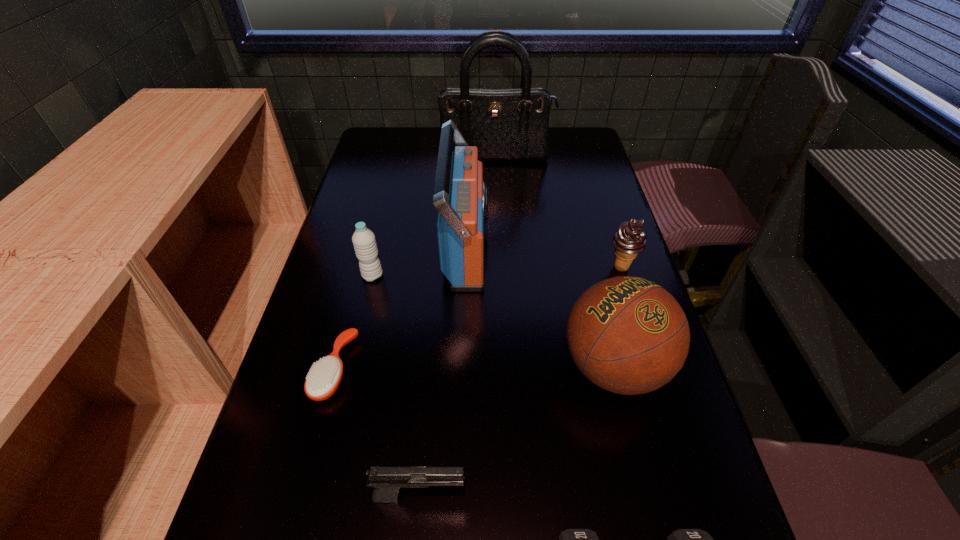
Where is `free space between the icecream and the radio receiver`? Image resolution: width=960 pixels, height=540 pixels. free space between the icecream and the radio receiver is located at coordinates (543, 258).

At what (x,y) coordinates should I click in order to perform the action: click on empty location between the icecream and the tallest object. Please return your answer as a coordinate pair (x, y). The height and width of the screenshot is (540, 960). Looking at the image, I should click on (559, 213).

At what (x,y) coordinates should I click in order to perform the action: click on empty space that is in between the water bottle and the tallest object. Please return your answer as a coordinate pair (x, y). Looking at the image, I should click on (434, 217).

In order to click on unoccupied area between the handbag and the water bottle in this screenshot , I will do `click(434, 217)`.

Identify the location of vacant space that is in between the water bottle and the tallest object. (434, 217).

Choose which object is the second nearest neighbor to the radio receiver. Please provide its 2D coordinates. Your answer should be formatted as a tuple, i.e. [(x, y)], where the tuple contains the x and y coordinates of a point satisfying the conditions above.

[(627, 335)]

Identify which object is the third closest to the water bottle. Please provide its 2D coordinates. Your answer should be formatted as a tuple, i.e. [(x, y)], where the tuple contains the x and y coordinates of a point satisfying the conditions above.

[(627, 335)]

Where is `free location that satisfies the following two spatial constraints: 1. on the front-facing side of the second tallest object; 2. on the front side of the hairbrush`? This screenshot has width=960, height=540. free location that satisfies the following two spatial constraints: 1. on the front-facing side of the second tallest object; 2. on the front side of the hairbrush is located at coordinates (462, 369).

You are a GUI agent. You are given a task and a screenshot of the screen. Output one action in this format:
    pyautogui.click(x=<x>, y=<y>)
    Task: Click on the free space that satisfies the following two spatial constraints: 1. on the front-facing side of the basketball; 2. on the left side of the radio receiver
    This screenshot has height=540, width=960.
    Given the screenshot: What is the action you would take?
    pyautogui.click(x=462, y=367)

Locate an element on the screen. This screenshot has width=960, height=540. free space that satisfies the following two spatial constraints: 1. with an open clasp on the front of the tallest object; 2. on the left side of the icecream is located at coordinates (501, 267).